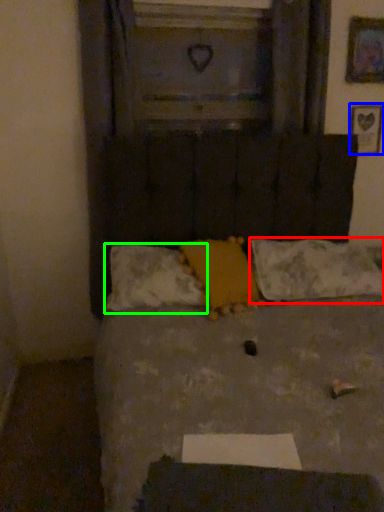
Question: Estimate the real-world distances between objects in this image. Which object is farther from pillow (highlighted by a red box), picture frame (highlighted by a blue box) or pillow (highlighted by a green box)?

Choices:
 (A) picture frame
 (B) pillow

Answer: (A)